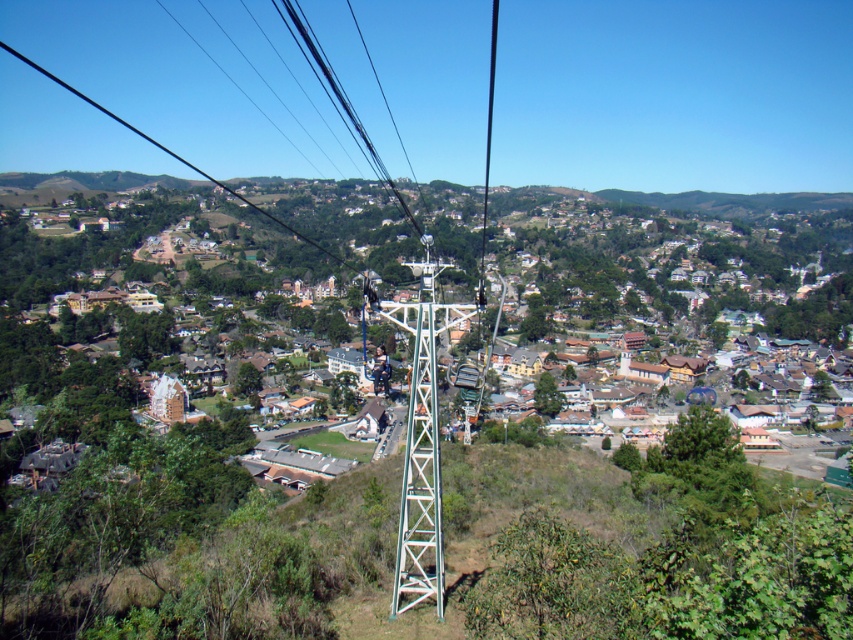
Can you confirm if brown wooden houses at lower left is bigger than black cable at center?

Yes.

How much distance is there between brown wooden houses at lower left and black cable at center?

brown wooden houses at lower left is 117.58 meters from black cable at center.

You are a GUI agent. You are given a task and a screenshot of the screen. Output one action in this format:
    pyautogui.click(x=<x>, y=<y>)
    Task: Click on the brown wooden houses at lower left
    The width and height of the screenshot is (853, 640).
    Given the screenshot: What is the action you would take?
    pyautogui.click(x=670, y=260)

This screenshot has height=640, width=853. What do you see at coordinates (421, 442) in the screenshot?
I see `green metallic tower at center` at bounding box center [421, 442].

Which is more to the right, green metallic tower at center or black cable at center?

From the viewer's perspective, black cable at center appears more on the right side.

Which is in front, point (426, 572) or point (492, 42)?

Point (426, 572) is more forward.

This screenshot has height=640, width=853. I want to click on green metallic tower at center, so click(x=421, y=442).

Is point (157, 145) closer to viewer compared to point (486, 189)?

No, it is behind (486, 189).

Who is positioned more to the left, black wire at left or black cable at center?

From the viewer's perspective, black wire at left appears more on the left side.

Is point (131, 129) farther from viewer compared to point (492, 83)?

Yes, it is.

Where is `black wire at left`? This screenshot has height=640, width=853. black wire at left is located at coordinates (177, 156).